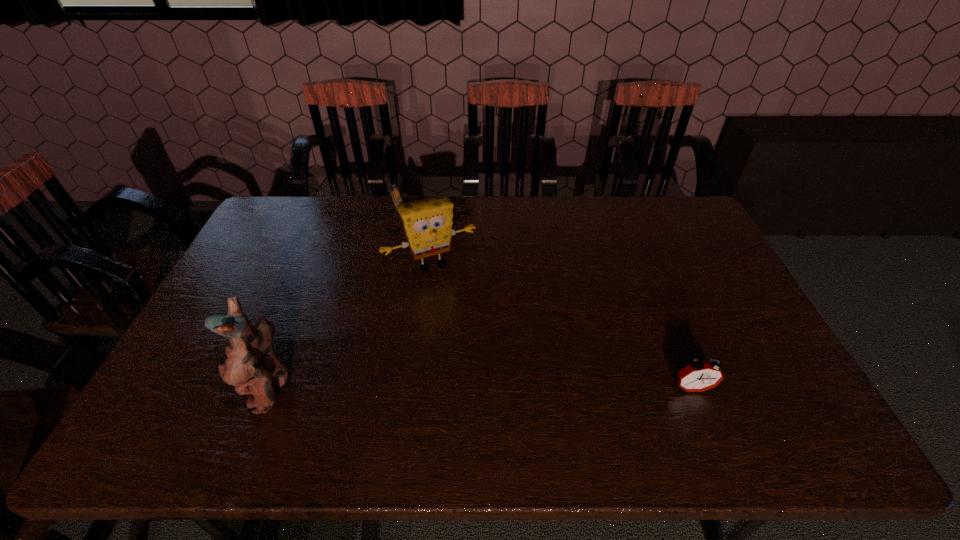
The width and height of the screenshot is (960, 540). Identify the location of free spot at the near edge of the desktop. (649, 380).

In the image, there is a desktop. Where is `vacant space at the left edge`? Image resolution: width=960 pixels, height=540 pixels. vacant space at the left edge is located at coordinates (213, 352).

I want to click on vacant space at the right edge, so click(x=702, y=295).

In order to click on free space at the far left corner in this screenshot , I will do `click(295, 200)`.

The image size is (960, 540). In the image, there is a desktop. In order to click on vacant space at the far right corner in this screenshot , I will do `click(678, 220)`.

Find the location of `free space between the tallest object and the sponge`. free space between the tallest object and the sponge is located at coordinates (351, 327).

This screenshot has width=960, height=540. I want to click on free space between the leftmost object and the second farthest object, so click(x=351, y=327).

Where is `free space between the tallest object and the shortest object`? The image size is (960, 540). free space between the tallest object and the shortest object is located at coordinates (335, 299).

In order to click on free spot between the third tallest object and the sponge in this screenshot , I will do `click(562, 327)`.

Identify the location of unoccupied position between the second tallest object and the second shortest object. (562, 327).